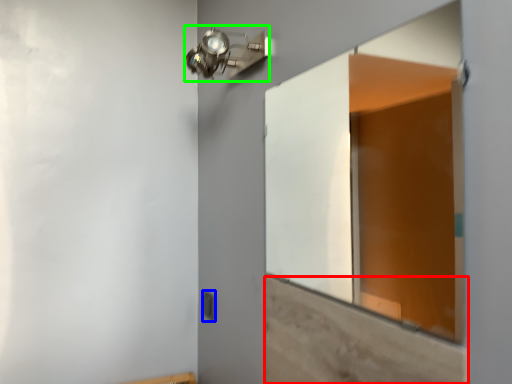
Question: Estimate the real-world distances between objects in this image. Which object is closer to plywood (highlighted by a red box), light switch (highlighted by a blue box) or light fixture (highlighted by a green box)?

Choices:
 (A) light switch
 (B) light fixture

Answer: (B)